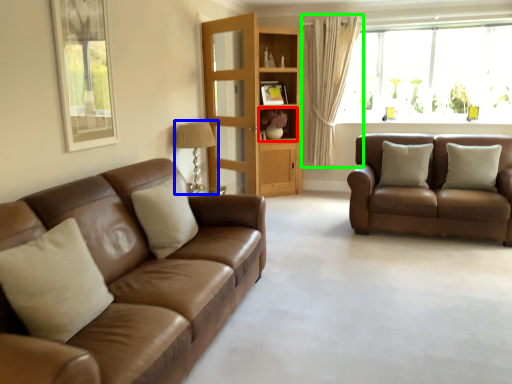
Question: Which object is positioned closest to shelf (highlighted by a red box)? Select from lamp (highlighted by a blue box) and curtain (highlighted by a green box).

Choices:
 (A) lamp
 (B) curtain

Answer: (B)